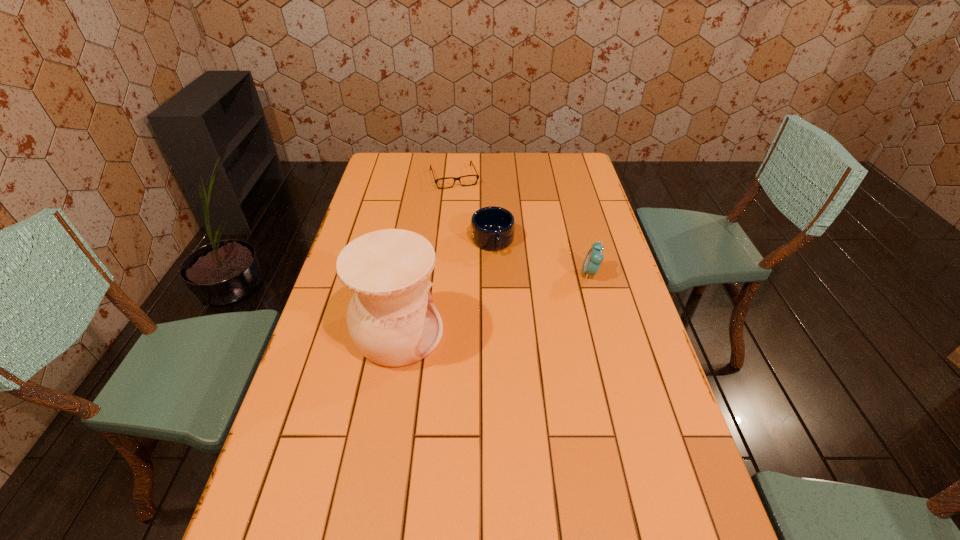
This screenshot has height=540, width=960. Identify the location of pottery. (392, 319).

Where is `the tallest object`? The width and height of the screenshot is (960, 540). the tallest object is located at coordinates (392, 319).

This screenshot has height=540, width=960. Find the location of `the rightmost object`. the rightmost object is located at coordinates (594, 258).

Image resolution: width=960 pixels, height=540 pixels. Find the location of `the second nearest object`. the second nearest object is located at coordinates (594, 258).

The image size is (960, 540). I want to click on the second farthest object, so click(492, 228).

Locate an element on the screen. The image size is (960, 540). the second shortest object is located at coordinates (492, 228).

The image size is (960, 540). Find the location of `spectacles`. spectacles is located at coordinates (477, 176).

You are a GUI agent. You are given a task and a screenshot of the screen. Output one action in this format:
    pyautogui.click(x=<x>, y=<y>)
    Task: Click on the shortest object
    
    Given the screenshot: What is the action you would take?
    pyautogui.click(x=477, y=176)

The image size is (960, 540). In order to click on vacant space located 0.080m at the open side of the nearest object in this screenshot , I will do `click(471, 333)`.

Identify the location of free space located 0.160m on the face of the alarm clock. The height and width of the screenshot is (540, 960). (531, 273).